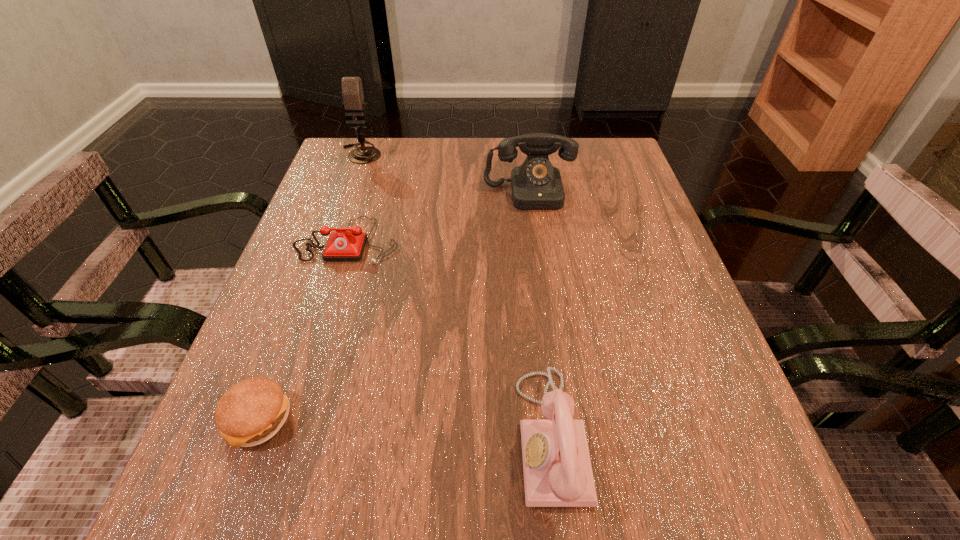
Where is `vacant region located on the dial of the third tallest object`? vacant region located on the dial of the third tallest object is located at coordinates pos(340,436).

Locate an element on the screen. The image size is (960, 540). free space located 0.060m on the dial of the third tallest object is located at coordinates (477, 436).

Identify the location of free location located 0.330m on the dial of the third tallest object. (291, 436).

The image size is (960, 540). I want to click on free space located on the dial of the shortest telephone, so click(x=303, y=385).

I want to click on blank space located 0.220m on the right of the hamburger, so click(x=438, y=418).

Find the location of a particular element. This screenshot has width=960, height=540. microphone located in the far edge section of the desktop is located at coordinates (352, 91).

At what (x,y) coordinates should I click in order to perform the action: click on telephone present at the far edge. Please return your answer as a coordinate pair (x, y). Looking at the image, I should click on (536, 185).

Find the location of a particular element. object that is at the near edge is located at coordinates (557, 467).

Where is `microphone that is at the left edge`? This screenshot has width=960, height=540. microphone that is at the left edge is located at coordinates (352, 91).

Find the location of a particular element. This screenshot has width=960, height=540. telephone located in the left edge section of the desktop is located at coordinates (342, 245).